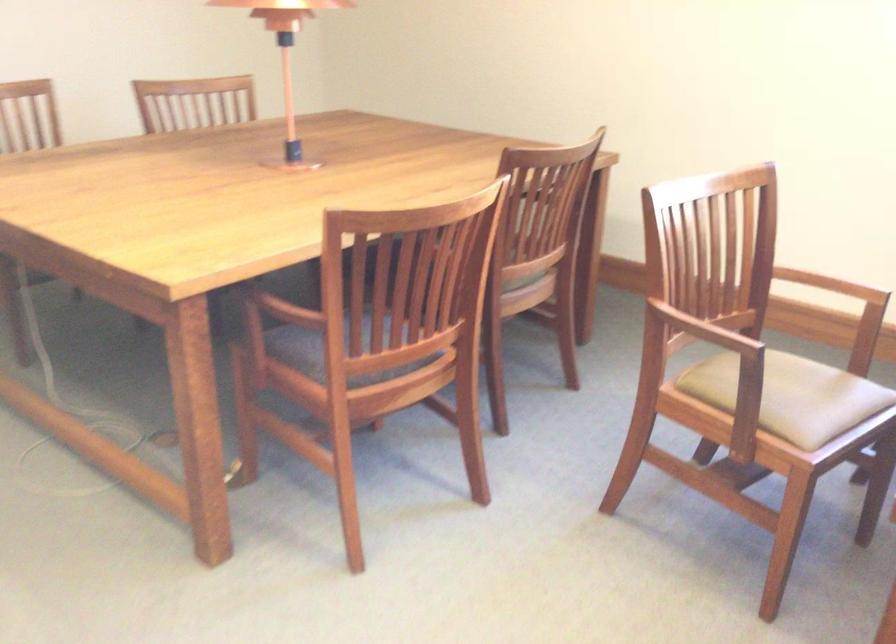
The width and height of the screenshot is (896, 644). I want to click on copper table lamp, so click(x=286, y=55).